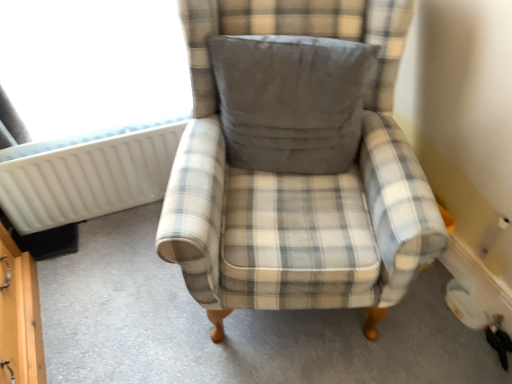
What is the approximate height of white plastic radiator at left?

white plastic radiator at left is 43.33 centimeters in height.

Describe the element at coordinates (291, 100) in the screenshot. I see `gray fabric pillow at center` at that location.

Consider the image. What is the approximate height of gray fabric pillow at center?

It is 41.27 centimeters.

At what (x,y) coordinates should I click in order to perform the action: click on white plastic radiator at left. Please return your answer as a coordinate pair (x, y). The image size is (512, 384). Looking at the image, I should click on (88, 179).

Between transparent plastic radiator at upper left and plaid fabric armchair at center, which one has smaller width?

transparent plastic radiator at upper left.

Considering the sizes of objects transparent plastic radiator at upper left and plaid fabric armchair at center in the image provided, who is bigger, transparent plastic radiator at upper left or plaid fabric armchair at center?

With larger size is plaid fabric armchair at center.

Is transparent plastic radiator at upper left turned away from plaid fabric armchair at center?

transparent plastic radiator at upper left does not have its back to plaid fabric armchair at center.

Consider the image. Is transparent plastic radiator at upper left in contact with plaid fabric armchair at center?

No, transparent plastic radiator at upper left is not touching plaid fabric armchair at center.

Which of these two, plaid fabric armchair at center or gray fabric pillow at center, stands shorter?

gray fabric pillow at center is shorter.

Considering the positions of objects plaid fabric armchair at center and gray fabric pillow at center in the image provided, who is behind, plaid fabric armchair at center or gray fabric pillow at center?

gray fabric pillow at center is more distant.

Is plaid fabric armchair at center oriented towards gray fabric pillow at center?

Yes, plaid fabric armchair at center is oriented towards gray fabric pillow at center.

Considering the positions of objects plaid fabric armchair at center and transparent plastic radiator at upper left in the image provided, who is in front, plaid fabric armchair at center or transparent plastic radiator at upper left?

plaid fabric armchair at center is in front.

From a real-world perspective, is plaid fabric armchair at center physically located above or below transparent plastic radiator at upper left?

In terms of real-world spatial position, plaid fabric armchair at center is below transparent plastic radiator at upper left.

Considering the positions of point (321, 167) and point (162, 21), is point (321, 167) closer or farther from the camera than point (162, 21)?

Point (321, 167) is positioned closer to the camera compared to point (162, 21).

How far apart are plaid fabric armchair at center and transparent plastic radiator at upper left?

The distance of plaid fabric armchair at center from transparent plastic radiator at upper left is 27.15 inches.

How many degrees apart are the facing directions of gray fabric pillow at center and white plastic radiator at left?

26.2 degrees separate the facing orientations of gray fabric pillow at center and white plastic radiator at left.

Is gray fabric pillow at center placed right next to white plastic radiator at left?

gray fabric pillow at center is not next to white plastic radiator at left, and they're not touching.

Is gray fabric pillow at center oriented away from white plastic radiator at left?

No.

Does plaid fabric armchair at center appear on the right side of white plastic radiator at left?

Correct, you'll find plaid fabric armchair at center to the right of white plastic radiator at left.

Based on the photo, how different are the orientations of plaid fabric armchair at center and white plastic radiator at left in degrees?

21.3 degrees.

Between plaid fabric armchair at center and white plastic radiator at left, which one has larger size?

plaid fabric armchair at center.

Is white plastic radiator at left at the back of plaid fabric armchair at center?

No, plaid fabric armchair at center is not facing away from white plastic radiator at left.

Is plaid fabric armchair at center at the back of white plastic radiator at left?

That's not correct — white plastic radiator at left is not looking away from plaid fabric armchair at center.

Does point (106, 210) lie behind point (395, 301)?

Yes, point (106, 210) is farther from viewer.

From the image's perspective, is white plastic radiator at left under plaid fabric armchair at center?

No.

Is white plastic radiator at left with plaid fabric armchair at center?

No, white plastic radiator at left is not in contact with plaid fabric armchair at center.

Is gray fabric pillow at center positioned beyond the bounds of plaid fabric armchair at center?

No, gray fabric pillow at center is inside plaid fabric armchair at center's boundary.

Looking at this image, which of these two, gray fabric pillow at center or plaid fabric armchair at center, stands taller?

plaid fabric armchair at center.

Does gray fabric pillow at center have a larger size compared to plaid fabric armchair at center?

Actually, gray fabric pillow at center might be smaller than plaid fabric armchair at center.

Image resolution: width=512 pixels, height=384 pixels. Find the location of `window screen positioned vertically above the plaid fabric armchair at center (from a real-world perspective)`. window screen positioned vertically above the plaid fabric armchair at center (from a real-world perspective) is located at coordinates (92, 64).

Where is `chair to the right of gray fabric pillow at center`? This screenshot has width=512, height=384. chair to the right of gray fabric pillow at center is located at coordinates (296, 161).

From the image, which object appears to be nearer to gray fabric pillow at center, plaid fabric armchair at center or transparent plastic radiator at upper left?

The object closer to gray fabric pillow at center is plaid fabric armchair at center.

Considering their positions, is gray fabric pillow at center positioned closer to white plastic radiator at left than plaid fabric armchair at center?

Result: Based on the image, gray fabric pillow at center appears to be nearer to white plastic radiator at left.

Looking at the image, which one is located further to plaid fabric armchair at center, gray fabric pillow at center or white plastic radiator at left?

white plastic radiator at left.

Which object lies nearer to the anchor point plaid fabric armchair at center, gray fabric pillow at center or transparent plastic radiator at upper left?

Based on the image, gray fabric pillow at center appears to be nearer to plaid fabric armchair at center.

When comparing their distances from transparent plastic radiator at upper left, does gray fabric pillow at center or white plastic radiator at left seem further?

Among the two, gray fabric pillow at center is located further to transparent plastic radiator at upper left.

Considering their positions, is plaid fabric armchair at center positioned closer to white plastic radiator at left than transparent plastic radiator at upper left?

The object closer to white plastic radiator at left is transparent plastic radiator at upper left.

Which object lies nearer to the anchor point gray fabric pillow at center, plaid fabric armchair at center or white plastic radiator at left?

Based on the image, plaid fabric armchair at center appears to be nearer to gray fabric pillow at center.

When comparing their distances from plaid fabric armchair at center, does transparent plastic radiator at upper left or gray fabric pillow at center seem further?

The object further to plaid fabric armchair at center is transparent plastic radiator at upper left.

Where is `pillow situated between transparent plastic radiator at upper left and plaid fabric armchair at center from left to right`? The image size is (512, 384). pillow situated between transparent plastic radiator at upper left and plaid fabric armchair at center from left to right is located at coordinates (291, 100).

The image size is (512, 384). In order to click on pillow located between white plastic radiator at left and plaid fabric armchair at center in the left-right direction in this screenshot , I will do `click(291, 100)`.

Find the location of a particular element. The height and width of the screenshot is (384, 512). window screen between white plastic radiator at left and plaid fabric armchair at center is located at coordinates tap(92, 64).

The image size is (512, 384). Identify the location of window screen between white plastic radiator at left and gray fabric pillow at center from left to right. (92, 64).